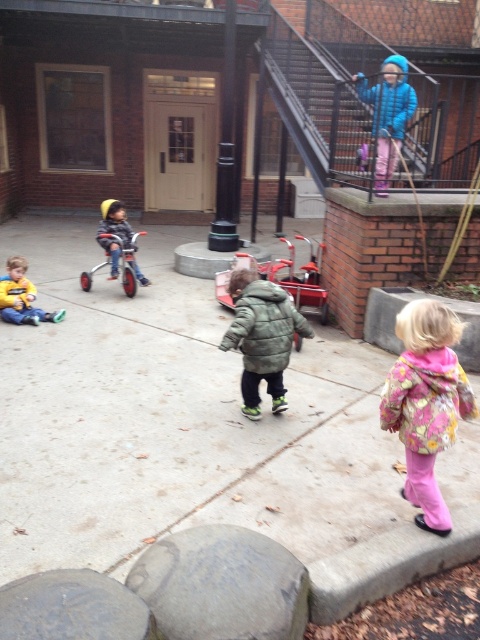
Is green fuzzy jacket at center shorter than metallic red tricycle at center?

Correct, green fuzzy jacket at center is not as tall as metallic red tricycle at center.

Does point (297, 326) lie behind point (280, 262)?

No, (297, 326) is closer to viewer.

Which is in front, point (298, 326) or point (247, 253)?

Point (298, 326) is in front.

In order to click on green fuzzy jacket at center in this screenshot , I will do `click(264, 326)`.

Which is behind, point (268, 362) or point (11, 269)?

Point (11, 269)

Is point (276, 364) closer to camera compared to point (2, 316)?

Yes.

This screenshot has height=640, width=480. I want to click on green fuzzy jacket at center, so click(x=264, y=326).

At what (x,y) coordinates should I click in order to perform the action: click on yellow fleece jacket at lower left. Please return your answer as a coordinate pair (x, y). The height and width of the screenshot is (640, 480). Looking at the image, I should click on (22, 296).

Is yellow fleece jacket at lower left bigger than matte blue helmet at left?

Yes, yellow fleece jacket at lower left is bigger than matte blue helmet at left.

Locate an element on the screen. The width and height of the screenshot is (480, 640). yellow fleece jacket at lower left is located at coordinates (22, 296).